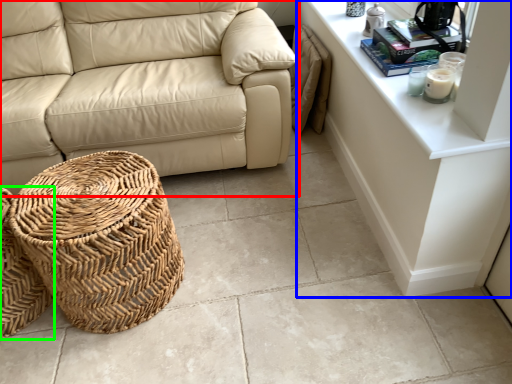
Question: Considering the real-world distances, which object is farthest from studio couch (highlighted by a red box)? dresser (highlighted by a blue box) or basket (highlighted by a green box)?

Choices:
 (A) dresser
 (B) basket

Answer: (B)